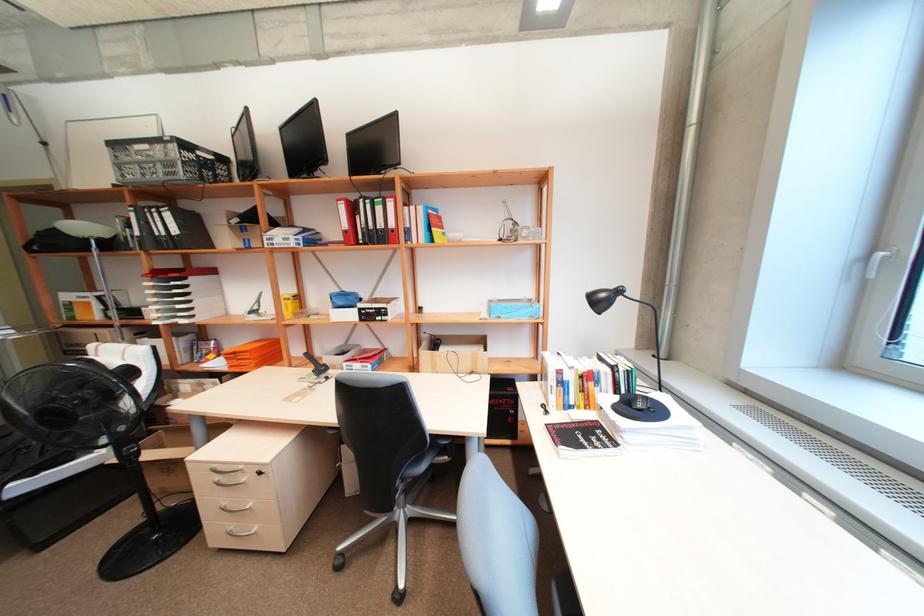
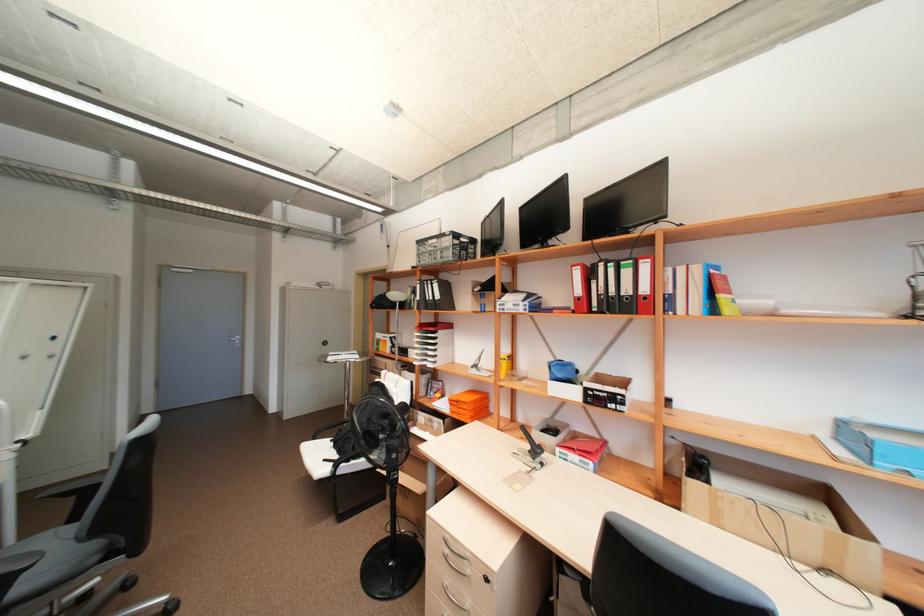
Find the pixel in the second image that matches (x=350, y=225) in the first image.

(584, 291)